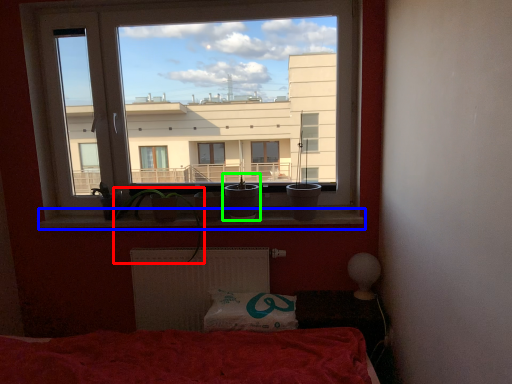
Question: Based on their relative distances, which object is nearer to plant (highlighted by a red box)? Choose from window sill (highlighted by a blue box) and houseplant (highlighted by a green box).

Choices:
 (A) window sill
 (B) houseplant

Answer: (A)